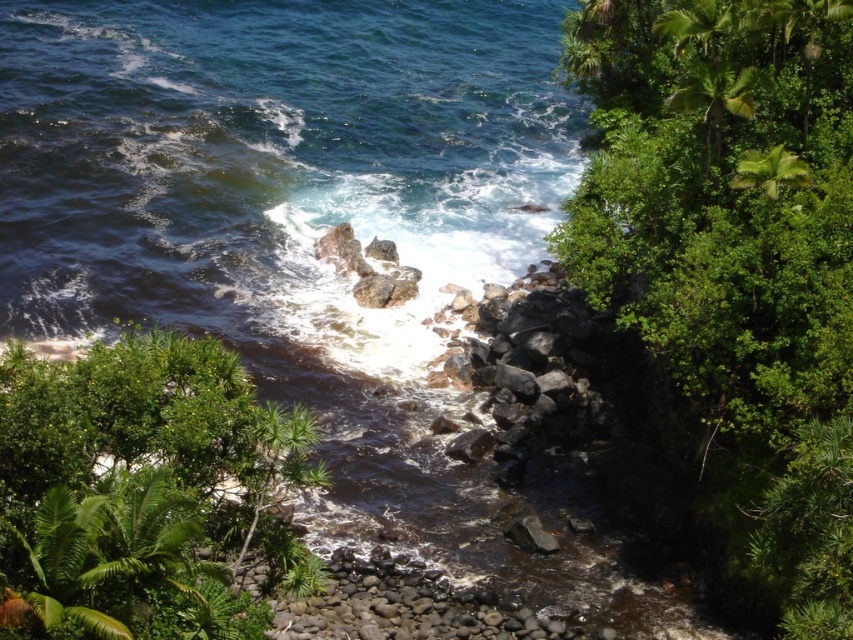
Is point (846, 88) closer to viewer compared to point (212, 636)?

No, it is behind (212, 636).

Does green leafy shrubs at right have a greater height compared to green leafy shrub at lower left?

Yes.

The height and width of the screenshot is (640, 853). Describe the element at coordinates (734, 257) in the screenshot. I see `green leafy shrubs at right` at that location.

Locate an element on the screen. The width and height of the screenshot is (853, 640). green leafy shrubs at right is located at coordinates (734, 257).